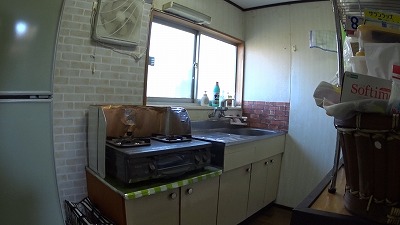
This screenshot has height=225, width=400. I want to click on window, so click(x=180, y=60).